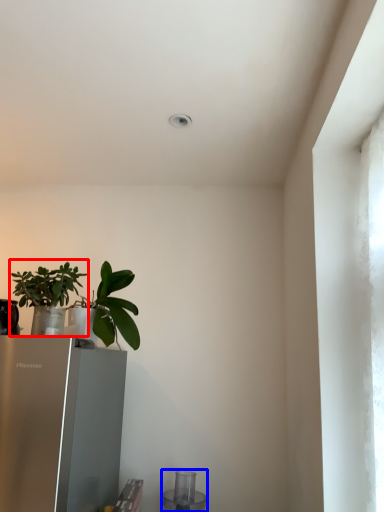
Question: Which object appears closest to the camera in this image, houseplant (highlighted by a red box) or appliance (highlighted by a blue box)?

Choices:
 (A) houseplant
 (B) appliance

Answer: (A)